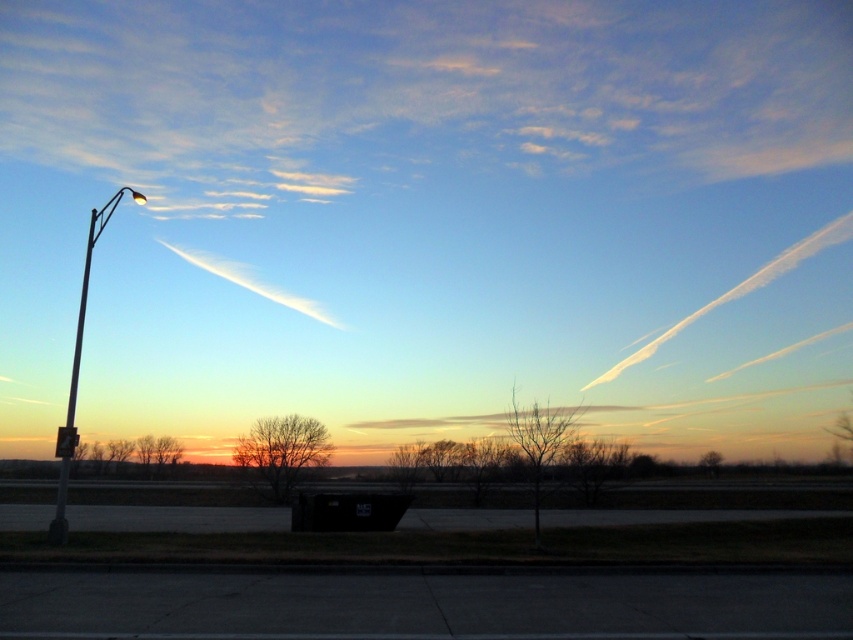
Who is higher up, white metallic pole at left or silver metallic pole at left?

Positioned higher is white metallic pole at left.

Based on the photo, can you confirm if white metallic pole at left is positioned to the left of silver metallic pole at left?

In fact, white metallic pole at left is to the right of silver metallic pole at left.

Is point (134, 200) positioned before point (64, 484)?

No, (134, 200) is behind (64, 484).

Identify the location of white metallic pole at left. (78, 369).

Locate an element on the screen. silver metallic pole at left is located at coordinates click(x=80, y=323).

Between point (68, 404) and point (412, 426), which one is positioned behind?

The point (412, 426) is behind.

Which is in front, point (59, 524) or point (445, 424)?

Point (59, 524) is in front.

Locate an element on the screen. The width and height of the screenshot is (853, 640). silver metallic pole at left is located at coordinates (80, 323).

Which is in front, point (604, 381) or point (460, 420)?

Point (460, 420) is more forward.

Where is `white cotton cloud at upper right`? white cotton cloud at upper right is located at coordinates (741, 289).